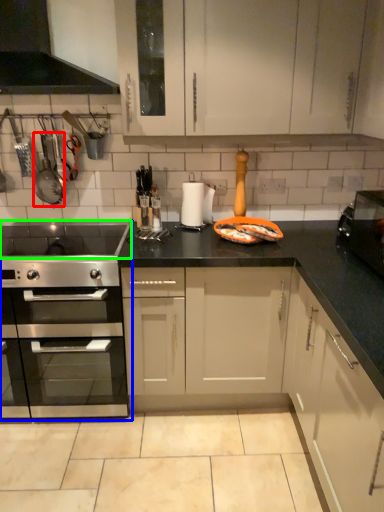
Question: Which is farther away from appliance (highlighted by a red box)? kitchen appliance (highlighted by a blue box) or gas stove (highlighted by a green box)?

Choices:
 (A) kitchen appliance
 (B) gas stove

Answer: (A)